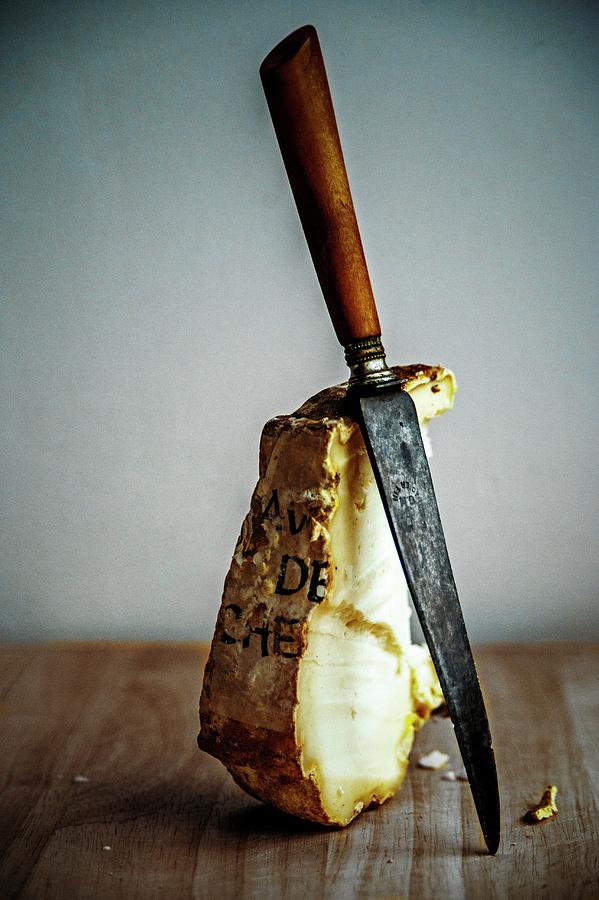
Where is `wooden tabletop`? wooden tabletop is located at coordinates (107, 758), (552, 694).